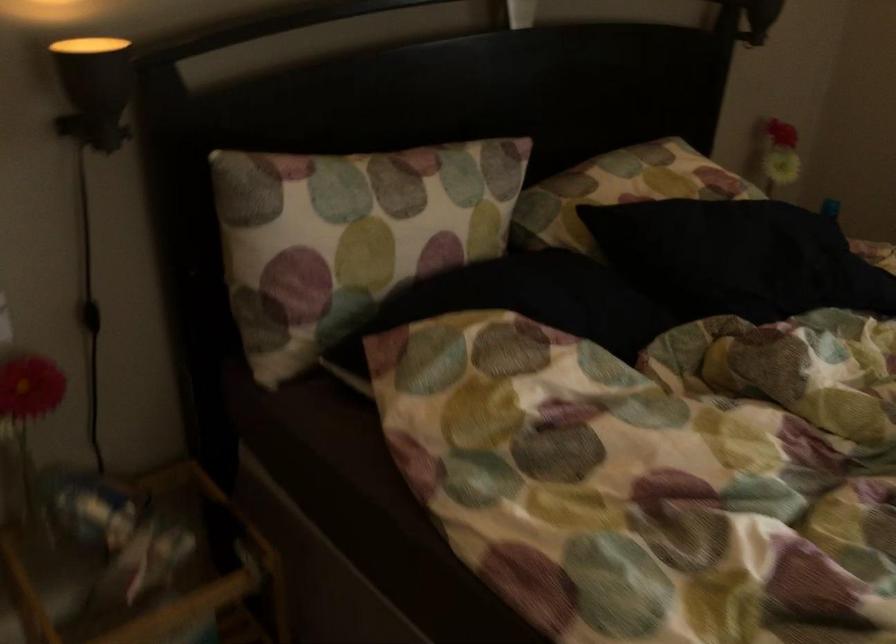
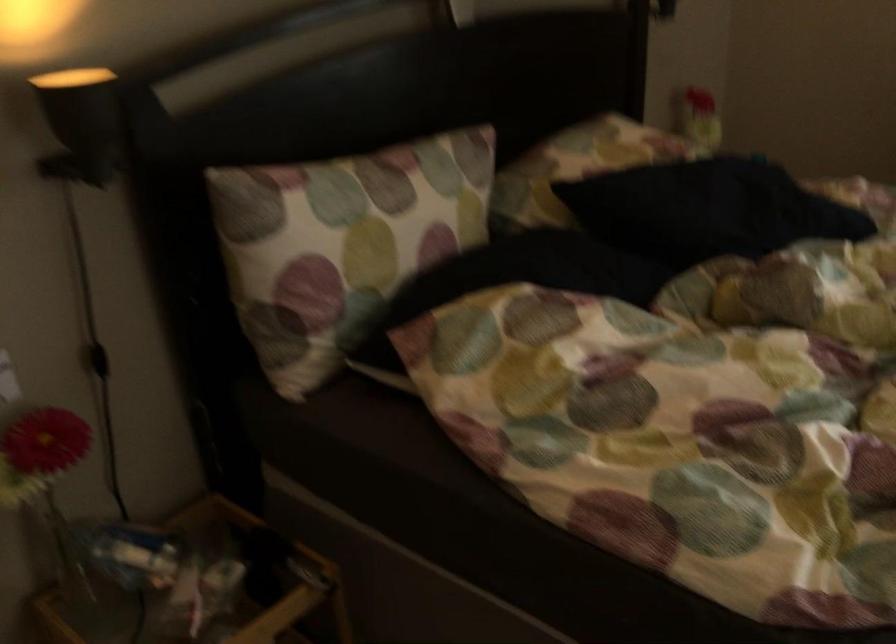
Question: The images are taken continuously from a first-person perspective. In which direction are you moving?

Choices:
 (A) Left
 (B) Right
 (C) Forward
 (D) Backward

Answer: (A)